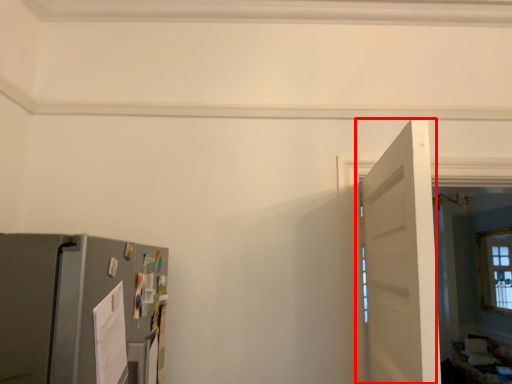
Question: Observing the image, what is the correct spatial positioning of door (annotated by the red box) in reference to appliance?

Choices:
 (A) left
 (B) right

Answer: (B)